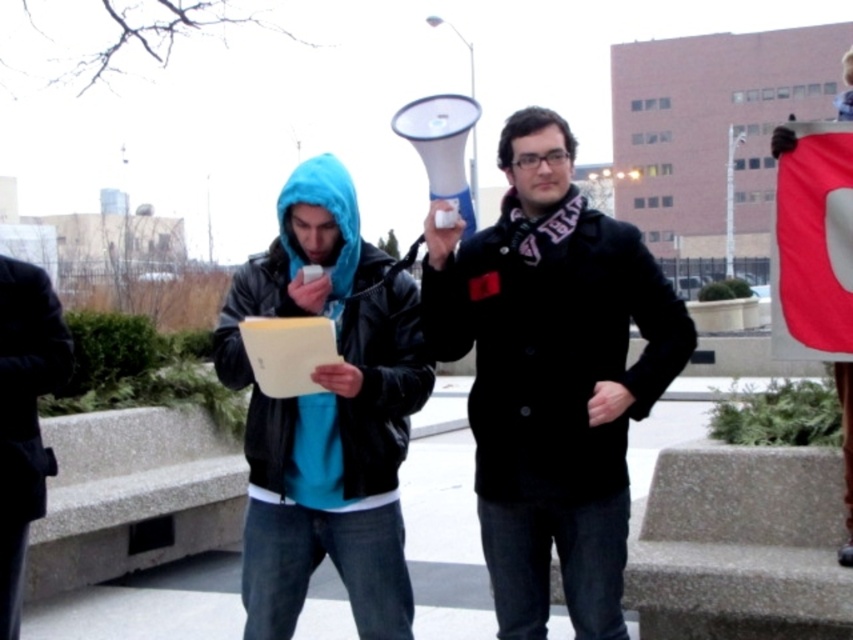
Who is higher up, black wool coat at center or black leather jacket at left?

black leather jacket at left is higher up.

Can you confirm if black wool coat at center is shorter than black leather jacket at left?

Yes, black wool coat at center is shorter than black leather jacket at left.

Locate an element on the screen. The height and width of the screenshot is (640, 853). black wool coat at center is located at coordinates (550, 376).

The width and height of the screenshot is (853, 640). Find the location of `black wool coat at center`. black wool coat at center is located at coordinates (550, 376).